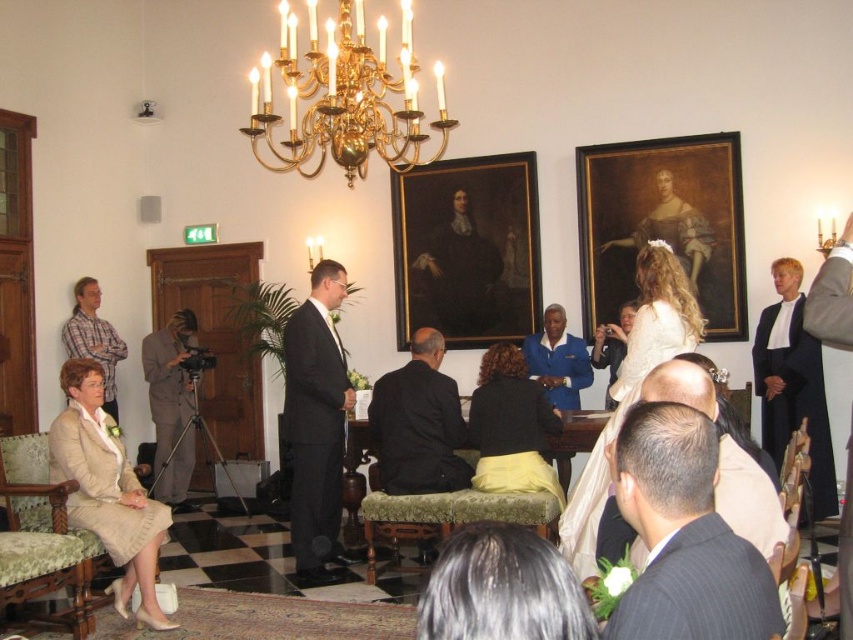
Does black fabric suit at center appear on the left side of black wool suit at right?

Indeed, black fabric suit at center is positioned on the left side of black wool suit at right.

Is black fabric suit at center closer to camera compared to black wool suit at right?

That is True.

Describe the element at coordinates (418, 422) in the screenshot. I see `black fabric suit at center` at that location.

Identify the location of black fabric suit at center. This screenshot has width=853, height=640. (418, 422).

Looking at this image, who is positioned more to the left, black wool suit at right or beige fabric chair at lower left?

beige fabric chair at lower left

Is point (815, 515) more distant than point (51, 524)?

Yes, point (815, 515) is behind point (51, 524).

The width and height of the screenshot is (853, 640). Identify the location of black wool suit at right. (793, 385).

Can you confirm if black pinstripe suit at center is wider than oil painting portrait at center?

No.

This screenshot has width=853, height=640. Identify the location of black pinstripe suit at center. (683, 536).

What do you see at coordinates (683, 536) in the screenshot? I see `black pinstripe suit at center` at bounding box center [683, 536].

Where is `black pinstripe suit at center`? This screenshot has height=640, width=853. black pinstripe suit at center is located at coordinates (683, 536).